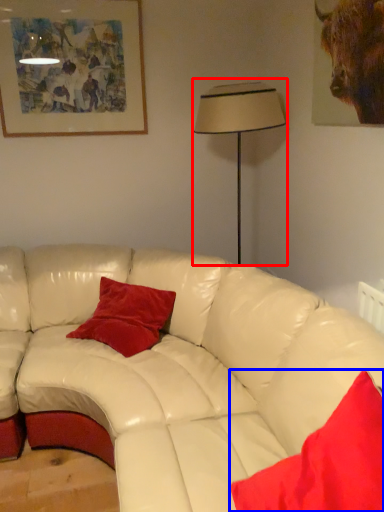
Question: Which object is further to the camera taking this photo, table lamp (highlighted by a red box) or pillow (highlighted by a blue box)?

Choices:
 (A) table lamp
 (B) pillow

Answer: (A)